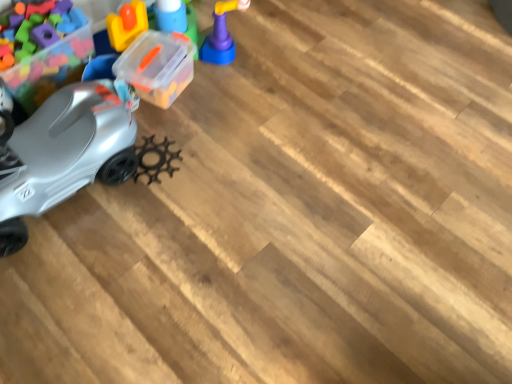
Question: Is metallic plastic car at left, acting as the 3th toy starting from the right, taller or shorter than silver matte car at left, the 2th toy positioned from the left?

Choices:
 (A) short
 (B) tall

Answer: (A)

Question: Considering their positions, is metallic plastic car at left, acting as the 3th toy starting from the right, located in front of or behind silver matte car at left, the second toy when ordered from right to left?

Choices:
 (A) front
 (B) behind

Answer: (B)

Question: Estimate the real-world distances between objects in this image. Which object is farther from the silver matte car at left, the second toy when ordered from right to left?

Choices:
 (A) metallic plastic car at left, the first toy when ordered from left to right
 (B) matte purple toy at upper center, which appears as the 1th toy when viewed from the right

Answer: (B)

Question: Estimate the real-world distances between objects in this image. Which object is closer to the matte purple toy at upper center, which appears as the 1th toy when viewed from the right?

Choices:
 (A) metallic plastic car at left, acting as the 3th toy starting from the right
 (B) silver matte car at left, the second toy when ordered from right to left

Answer: (B)